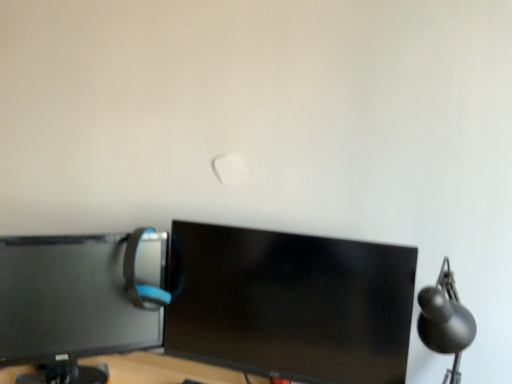
Question: From the image's perspective, is matte black monitor at left, marked as the 2th computer monitor in a right-to-left arrangement, located above or below matte gray computer chair at left?

Choices:
 (A) below
 (B) above

Answer: (A)

Question: Considering the positions of matte black monitor at left, the first computer monitor positioned from the left, and matte gray computer chair at left in the image, is matte black monitor at left, the first computer monitor positioned from the left, wider or thinner than matte gray computer chair at left?

Choices:
 (A) wide
 (B) thin

Answer: (A)

Question: Which is farther from the black glossy monitor at center, arranged as the second computer monitor when viewed from the left?

Choices:
 (A) matte black monitor at left, the first computer monitor positioned from the left
 (B) black matte table lamp at right
 (C) matte gray computer chair at left

Answer: (B)

Question: Based on their relative distances, which object is nearer to the black glossy monitor at center, arranged as the second computer monitor when viewed from the left?

Choices:
 (A) matte black monitor at left, marked as the 2th computer monitor in a right-to-left arrangement
 (B) matte gray computer chair at left
 (C) black matte table lamp at right

Answer: (A)